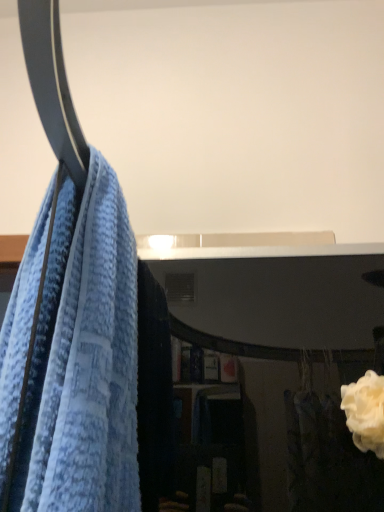
The width and height of the screenshot is (384, 512). I want to click on blue textured towel at left, so click(84, 361).

The width and height of the screenshot is (384, 512). Describe the element at coordinates (84, 361) in the screenshot. I see `blue textured towel at left` at that location.

Measure the distance between point [119,484] and camera.

37.80 centimeters.

Where is `white matte rose at lower right`? white matte rose at lower right is located at coordinates (365, 412).

The height and width of the screenshot is (512, 384). What do you see at coordinates (365, 412) in the screenshot?
I see `white matte rose at lower right` at bounding box center [365, 412].

In order to face white matte rose at lower right, should I rotate leftwards or rightwards?

To face it directly, rotate right by 23.375 degrees.

This screenshot has height=512, width=384. What are the coordinates of `blue textured towel at left` in the screenshot? It's located at (84, 361).

Which object is positioned more to the left, blue textured towel at left or white matte rose at lower right?

blue textured towel at left is more to the left.

Which object is further away from the camera, blue textured towel at left or white matte rose at lower right?

white matte rose at lower right is behind.

Does point (87, 349) come in front of point (382, 428)?

Yes, point (87, 349) is closer to viewer.

From the image's perspective, does blue textured towel at left appear higher than white matte rose at lower right?

Yes.

From a real-world perspective, between blue textured towel at left and white matte rose at lower right, who is vertically higher?

In real-world perspective, blue textured towel at left is above.

Between blue textured towel at left and white matte rose at lower right, which one has smaller width?

With smaller width is white matte rose at lower right.

Can you confirm if blue textured towel at left is taller than white matte rose at lower right?

Yes, blue textured towel at left is taller than white matte rose at lower right.

Does blue textured towel at left have a larger size compared to white matte rose at lower right?

Yes, blue textured towel at left is bigger than white matte rose at lower right.

Is blue textured towel at left not inside white matte rose at lower right?

blue textured towel at left is positioned outside white matte rose at lower right.

Consider the image. Are blue textured towel at left and white matte rose at lower right beside each other?

blue textured towel at left is not next to white matte rose at lower right, and they're not touching.

Is blue textured towel at left turned away from white matte rose at lower right?

Yes, white matte rose at lower right is at the back of blue textured towel at left.

How different are the orientations of blue textured towel at left and white matte rose at lower right in degrees?

90 degrees.

Locate an element on the screen. This screenshot has width=384, height=512. towel in front of the white matte rose at lower right is located at coordinates (84, 361).

Would you say white matte rose at lower right is to the left or to the right of blue textured towel at left in the picture?

Based on their positions, white matte rose at lower right is located to the right of blue textured towel at left.

Relative to blue textured towel at left, is white matte rose at lower right in front or behind?

white matte rose at lower right is behind blue textured towel at left.

Is point (348, 416) behind point (122, 496)?

Yes.

From the image's perspective, does white matte rose at lower right appear higher than blue textured towel at left?

No, from the image's perspective, white matte rose at lower right is not on top of blue textured towel at left.

From a real-world perspective, which is physically above, white matte rose at lower right or blue textured towel at left?

From a 3D spatial view, blue textured towel at left is above.

Between white matte rose at lower right and blue textured towel at left, which one has larger width?

blue textured towel at left.

In the scene shown: Considering the sizes of objects white matte rose at lower right and blue textured towel at left in the image provided, who is shorter, white matte rose at lower right or blue textured towel at left?

Standing shorter between the two is white matte rose at lower right.

Which of these two, white matte rose at lower right or blue textured towel at left, is smaller?

With smaller size is white matte rose at lower right.

Is white matte rose at lower right located outside blue textured towel at left?

Absolutely, white matte rose at lower right is external to blue textured towel at left.

Are white matte rose at lower right and blue textured towel at left far apart?

No, white matte rose at lower right is in close proximity to blue textured towel at left.

Does white matte rose at lower right turn towards blue textured towel at left?

No, white matte rose at lower right does not turn towards blue textured towel at left.

Locate an element on the screen. This screenshot has height=512, width=384. rose located below the blue textured towel at left (from the image's perspective) is located at coordinates (365, 412).

In order to click on rose below the blue textured towel at left (from a real-world perspective) in this screenshot , I will do `click(365, 412)`.

This screenshot has width=384, height=512. I want to click on towel located above the white matte rose at lower right (from the image's perspective), so click(x=84, y=361).